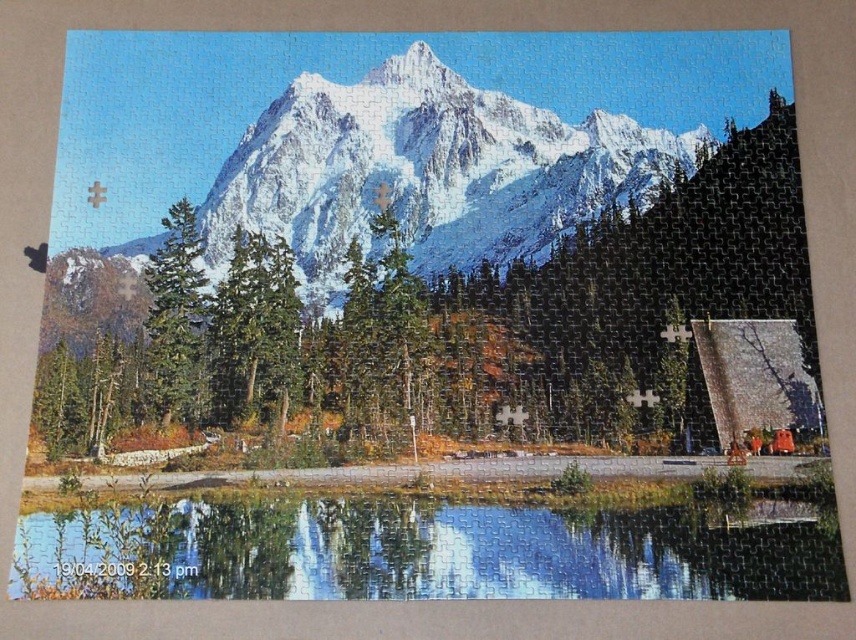
Question: Which object is the farthest from the green matte tree at center-left?

Choices:
 (A) white snow-covered mountain at upper center
 (B) green matte tree at center
 (C) transparent glass water at lower center

Answer: (C)

Question: Is green matte tree at center positioned in front of white snow-covered mountain at upper center?

Choices:
 (A) no
 (B) yes

Answer: (B)

Question: Which point appears closest to the camera in this image?

Choices:
 (A) (679, 369)
 (B) (168, 228)
 (C) (745, 554)

Answer: (C)

Question: Which point is closer to the camera?

Choices:
 (A) click(x=724, y=198)
 (B) click(x=301, y=109)
 (C) click(x=520, y=596)

Answer: (C)

Question: Is transparent glass water at lower center above green matte tree at center-left?

Choices:
 (A) no
 (B) yes

Answer: (A)

Question: Does transparent glass water at lower center lie in front of white snow-covered mountain at upper center?

Choices:
 (A) yes
 (B) no

Answer: (A)